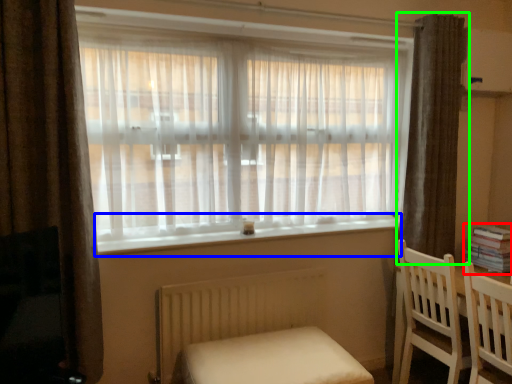
Question: Based on their relative distances, which object is farther from book (highlighted by a red box)? Choose from window sill (highlighted by a blue box) and curtain (highlighted by a green box).

Choices:
 (A) window sill
 (B) curtain

Answer: (A)